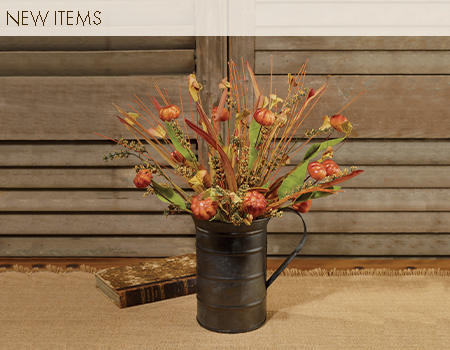
Locate an element on the screen. wooden slats is located at coordinates (81, 148), (77, 182), (75, 198), (75, 223), (366, 243), (370, 224), (375, 204), (378, 181).